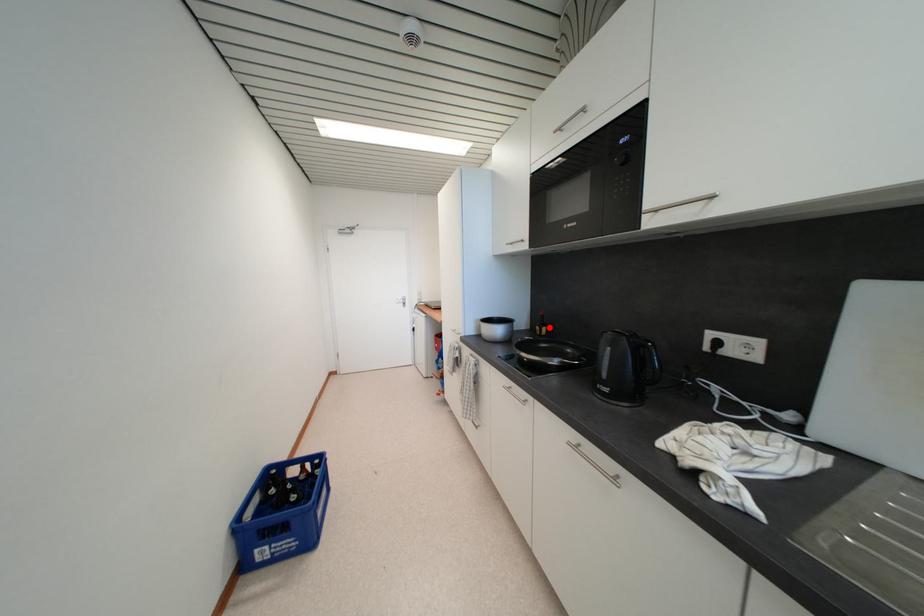
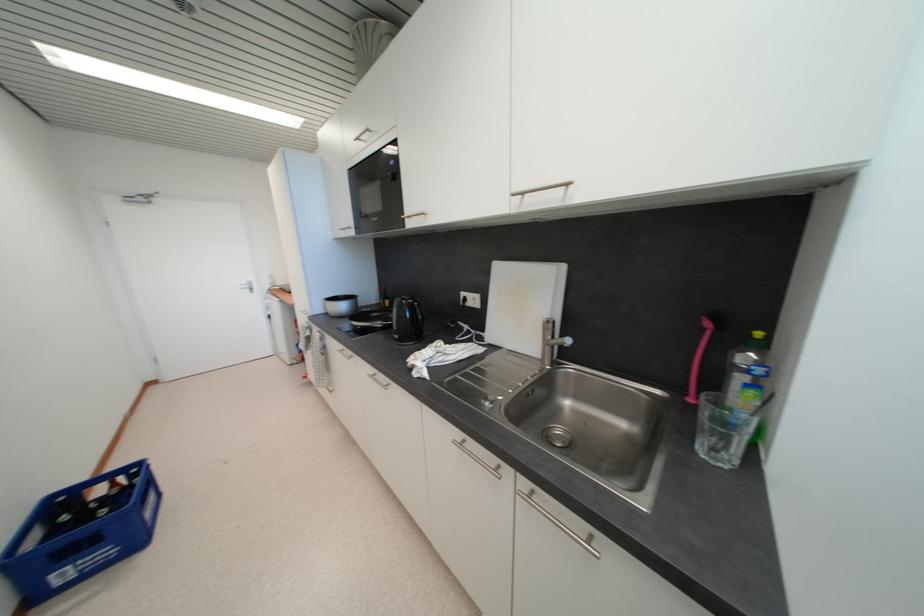
In the second image, find the point that corresponds to the highlighted location in the first image.

(392, 301)